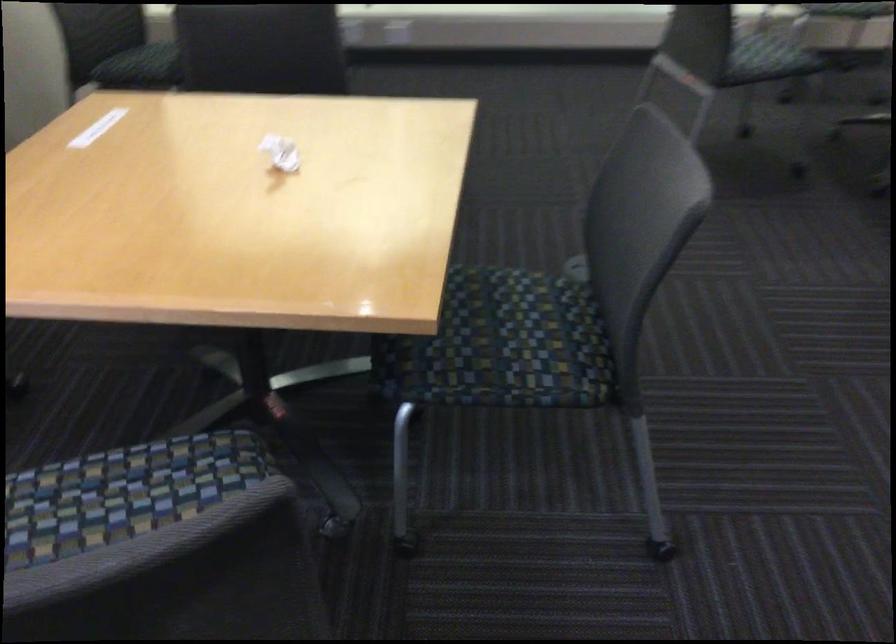
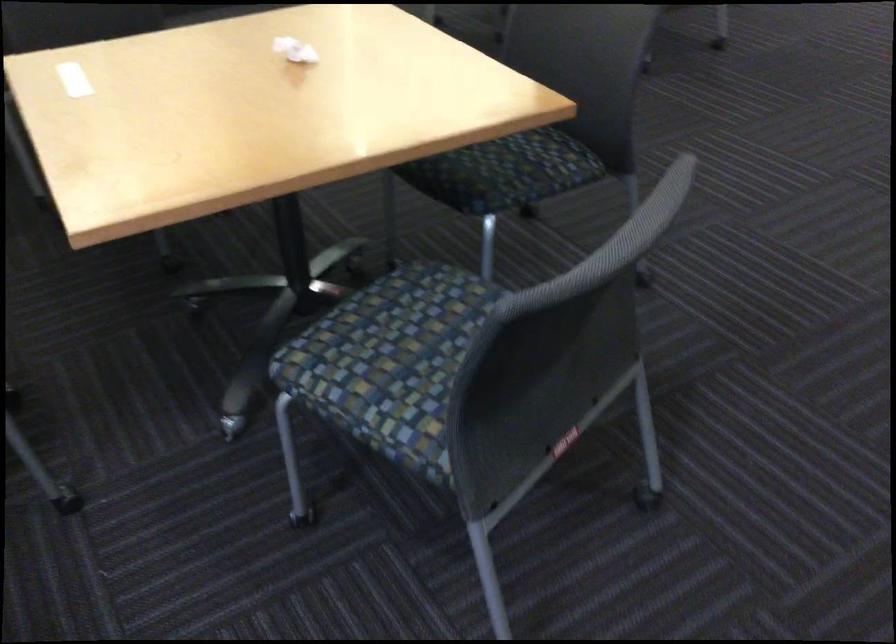
In the second image, find the point that corresponds to pixel 449 360 in the first image.

(504, 172)